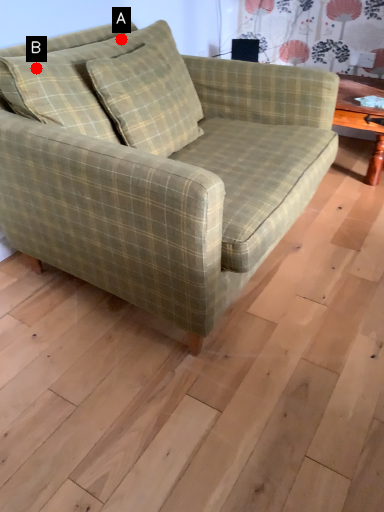
Question: Two points are circled on the image, labeled by A and B beside each circle. Which point is closer to the camera?

Choices:
 (A) A is closer
 (B) B is closer

Answer: (B)